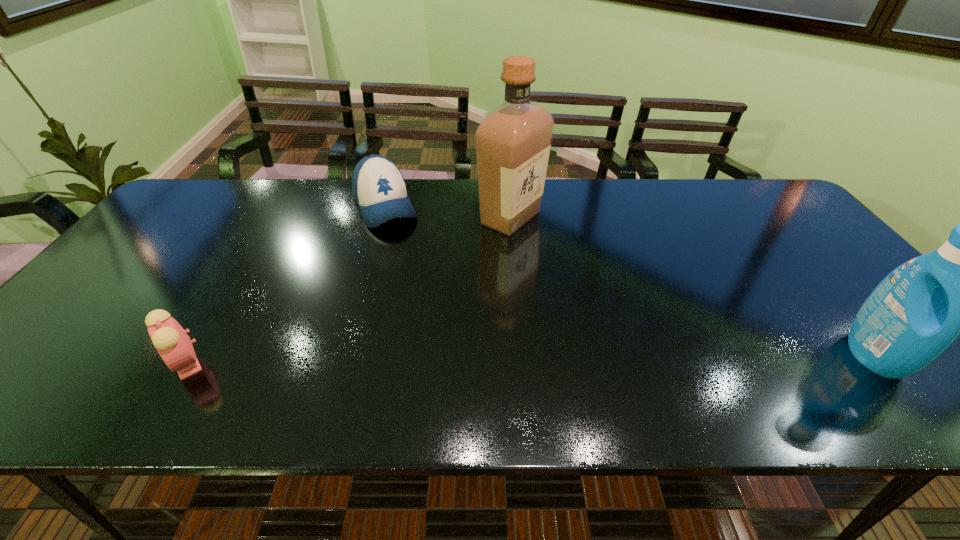
Find the location of a particular element. The image size is (960, 540). empty space that is in between the second tallest object and the second object from left to right is located at coordinates coord(630,281).

Image resolution: width=960 pixels, height=540 pixels. Identify the location of vacant space that is in between the alarm clock and the second object from left to right. (285, 285).

I want to click on empty space between the third object from left to right and the baseball cap, so click(x=448, y=212).

Image resolution: width=960 pixels, height=540 pixels. In order to click on free space between the baseball cap and the rightmost object in this screenshot , I will do `click(630, 281)`.

Where is `vacant space that is in between the leftmost object and the tallest object`? Image resolution: width=960 pixels, height=540 pixels. vacant space that is in between the leftmost object and the tallest object is located at coordinates 348,291.

At what (x,y) coordinates should I click in order to perform the action: click on vacant space that is in between the alarm clock and the rightmost object. Please return your answer as a coordinate pair (x, y). This screenshot has width=960, height=540. Looking at the image, I should click on (530, 359).

Locate an element on the screen. The width and height of the screenshot is (960, 540). the closest object to the alarm clock is located at coordinates coord(379,189).

Where is `the third closest object to the baseball cap`? The image size is (960, 540). the third closest object to the baseball cap is located at coordinates (919, 310).

Locate an element on the screen. This screenshot has width=960, height=540. vacant space that satisfies the following two spatial constraints: 1. on the front side of the rightmost object; 2. on the front-facing side of the tallest object is located at coordinates (523, 355).